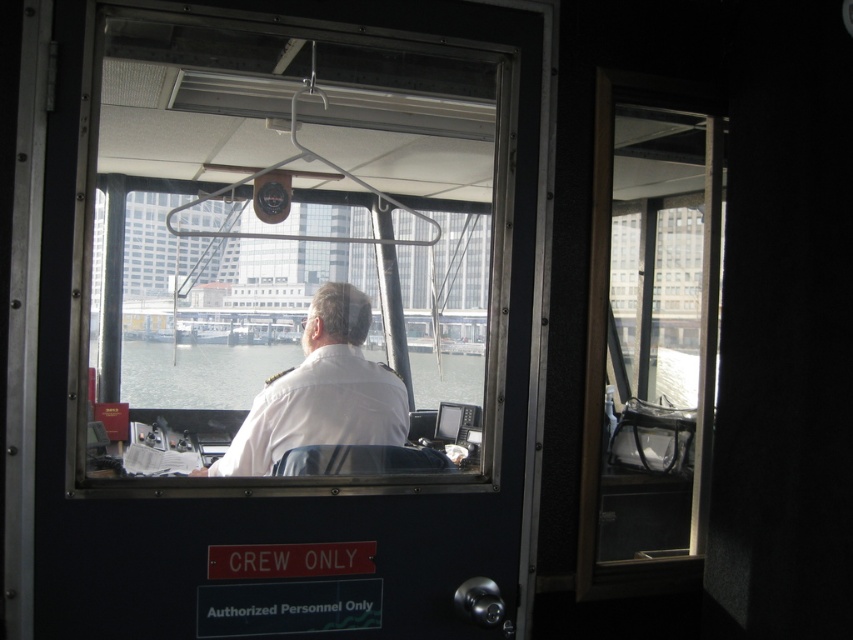
You are a passenger on the ship and want to see the person in the white uniform at center through the transparent glass window at upper right. Can you see the person clearly through the window?

The transparent glass window at upper right is above the white uniform at center, so you can see the person in the white uniform at center through the window as long as there are no obstructions.

You are a passenger on a cruise ship and want to see the view from the ship bridge. You are standing outside the CREW ONLY door and notice the transparent glass window at upper right and the clear water at center. Which object would allow you to see the outside ocean better?

The transparent glass window at upper right allows a better view of the outside ocean because it is larger in size compared to the clear water at center.

You are standing outside the ship bridge door and want to see the crew member inside. Which object, the transparent glass window at upper right or the clear water at center, would allow you to see the crew member better?

The transparent glass window at upper right allows better visibility since it has a greater height compared to the clear water at center, providing a clearer view of the crew member.